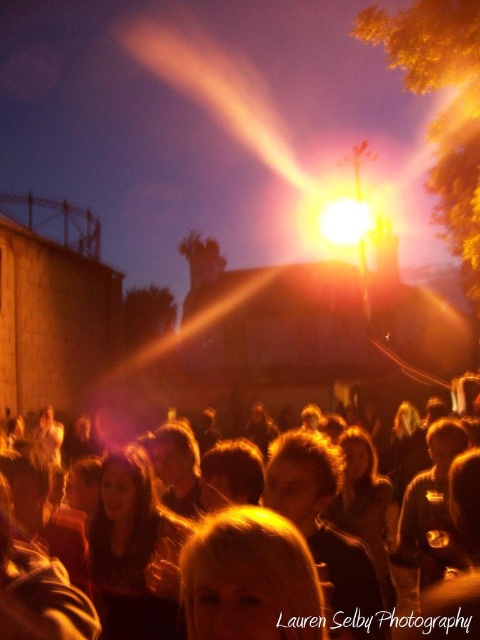
You are a photographer trying to capture a silhouette of the person with matte golden hair at center against the bright yellow light at center. Based on the scene description, will the person be visible in the silhouette?

The matte golden hair at center is in front of the bright yellow light at center, so the person with matte golden hair at center will be visible in the silhouette as their outline will block the light, creating a clear contrast against the bright yellow light at center.

You are a photographer trying to capture the perfect shot of the matte golden hair at center in the golden hour lighting. Based on the scene description, where should you position your camera to ensure the golden hair is well lit by the central light source?

The matte golden hair at center is located at point (445, 502), so position your camera to face that coordinate to capture the golden hair illuminated by the central light source.

You are a photographer trying to capture a photo of the matte golden hair at center and the bright yellow light at center. If your camera can only focus on objects within 100 meters, will both objects be in focus?

The distance between the matte golden hair at center and the bright yellow light at center is 91.09 meters, which is within the camera focus range of 100 meters. Therefore, both objects will be in focus.